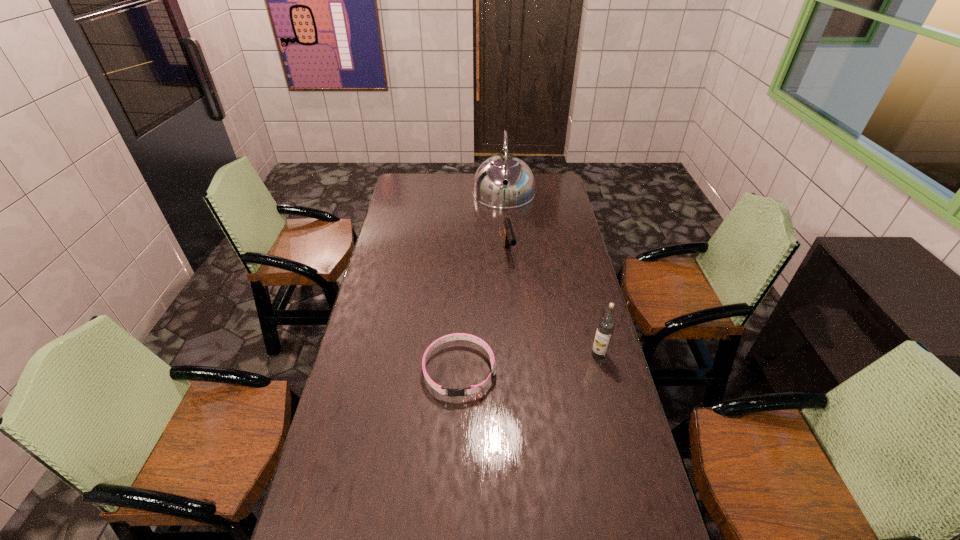
Identify the location of free spot between the third tallest object and the third shortest object. Image resolution: width=960 pixels, height=540 pixels. (554, 304).

I want to click on vacant point located between the second shortest object and the vodka, so click(554, 304).

This screenshot has height=540, width=960. In order to click on object that can be found as the closest to the rightmost object in this screenshot , I will do `click(452, 392)`.

Find the location of a particular element. Image resolution: width=960 pixels, height=540 pixels. object that ranks as the second closest to the dog collar is located at coordinates 509,238.

You are a GUI agent. You are given a task and a screenshot of the screen. Output one action in this format:
    pyautogui.click(x=<x>, y=<y>)
    Task: Click on the blank space that satisfies the following two spatial constraints: 1. on the front side of the vodka; 2. on the label of the tallest object
    This screenshot has width=960, height=540.
    Given the screenshot: What is the action you would take?
    pyautogui.click(x=516, y=355)

Identify the location of free space that satisfies the following two spatial constraints: 1. on the front side of the rightmost object; 2. on the label of the second shortest object. Image resolution: width=960 pixels, height=540 pixels. (516, 355).

The width and height of the screenshot is (960, 540). In order to click on vacant region that satisfies the following two spatial constraints: 1. on the front side of the second shortest object; 2. on the label of the rightmost object in this screenshot , I will do `click(516, 355)`.